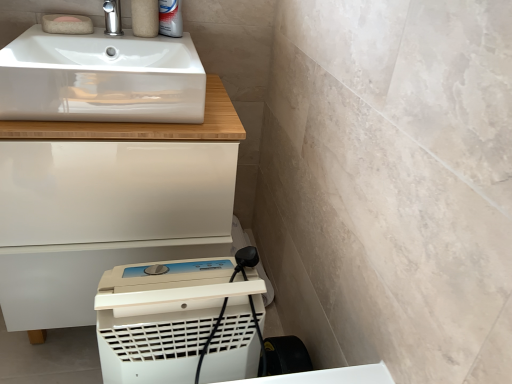
Measure the distance between point (174, 100) and camera.

Point (174, 100) is 37.24 inches from camera.

Describe the element at coordinates (68, 19) in the screenshot. The image size is (512, 384). I see `matte beige soap at upper left, the 2th soap positioned from the front` at that location.

Image resolution: width=512 pixels, height=384 pixels. What do you see at coordinates (177, 322) in the screenshot?
I see `white plastic dehumidifier at lower center` at bounding box center [177, 322].

Locate an element on the screen. pink felt soap at upper left, placed as the first soap when sorted from front to back is located at coordinates (67, 24).

Is point (73, 16) closer to camera compared to point (242, 366)?

No, (73, 16) is behind (242, 366).

What's the angular difference between pink felt soap at upper left, which is the 2th soap in back-to-front order, and white plastic dehumidifier at lower center's facing directions?

The angular difference between pink felt soap at upper left, which is the 2th soap in back-to-front order, and white plastic dehumidifier at lower center is 0.843 degrees.

Which object is further away from the camera, pink felt soap at upper left, which is the 2th soap in back-to-front order, or white plastic dehumidifier at lower center?

pink felt soap at upper left, which is the 2th soap in back-to-front order, is further away from the camera.

Is pink felt soap at upper left, which is the 2th soap in back-to-front order, turned away from white plastic dehumidifier at lower center?

pink felt soap at upper left, which is the 2th soap in back-to-front order, is not turned away from white plastic dehumidifier at lower center.

Identify the location of the 1st soap behind the polished chrome tap at upper left, counting from the anchor's position. The height and width of the screenshot is (384, 512). click(x=67, y=24).

Is pink felt soap at upper left, which is the 2th soap in back-to-front order, situated inside polished chrome tap at upper left or outside?

pink felt soap at upper left, which is the 2th soap in back-to-front order, is not enclosed by polished chrome tap at upper left.

Is the depth of pink felt soap at upper left, placed as the first soap when sorted from front to back, greater than that of polished chrome tap at upper left?

Yes, it is behind polished chrome tap at upper left.

From a real-world perspective, who is located lower, white glossy sink at upper left or pink felt soap at upper left, which is the 2th soap in back-to-front order?

white glossy sink at upper left is physically lower.

Is white glossy sink at upper left facing towards pink felt soap at upper left, placed as the first soap when sorted from front to back?

No, white glossy sink at upper left is not turned towards pink felt soap at upper left, placed as the first soap when sorted from front to back.

Is white glossy sink at upper left completely or partially outside of pink felt soap at upper left, which is the 2th soap in back-to-front order?

white glossy sink at upper left is positioned outside pink felt soap at upper left, which is the 2th soap in back-to-front order.

How many degrees apart are the facing directions of white glossy sink at upper left and pink felt soap at upper left, which is the 2th soap in back-to-front order?

Result: There is a 0.843-degree angle between the facing directions of white glossy sink at upper left and pink felt soap at upper left, which is the 2th soap in back-to-front order.

Can you tell me how much white plastic dehumidifier at lower center and white glossy sink at upper left differ in facing direction?

The angular difference between white plastic dehumidifier at lower center and white glossy sink at upper left is 0.000119 degrees.

Where is `sink located behind the white plastic dehumidifier at lower center`? This screenshot has width=512, height=384. sink located behind the white plastic dehumidifier at lower center is located at coordinates (101, 78).

Are white plastic dehumidifier at lower center and white glossy sink at upper left making contact?

No, white plastic dehumidifier at lower center is not in contact with white glossy sink at upper left.

From the image's perspective, does polished chrome tap at upper left appear lower than pink felt soap at upper left, which is the 2th soap in back-to-front order?

Incorrect, from the image's perspective, polished chrome tap at upper left is higher than pink felt soap at upper left, which is the 2th soap in back-to-front order.

Is polished chrome tap at upper left touching pink felt soap at upper left, placed as the first soap when sorted from front to back?

Absolutely, polished chrome tap at upper left is next to and touching pink felt soap at upper left, placed as the first soap when sorted from front to back.

From a real-world perspective, is polished chrome tap at upper left positioned above or below pink felt soap at upper left, placed as the first soap when sorted from front to back?

polished chrome tap at upper left is situated higher than pink felt soap at upper left, placed as the first soap when sorted from front to back, in the real world.

Is point (106, 10) farther from camera compared to point (61, 23)?

Yes, it is behind point (61, 23).

The image size is (512, 384). What are the coordinates of `appliance on the right of white glossy sink at upper left` in the screenshot? It's located at (177, 322).

Considering the sizes of white glossy sink at upper left and white plastic dehumidifier at lower center in the image, is white glossy sink at upper left wider or thinner than white plastic dehumidifier at lower center?

In the image, white glossy sink at upper left appears to be wider than white plastic dehumidifier at lower center.

Between white glossy sink at upper left and white plastic dehumidifier at lower center, which one has smaller size?

Smaller between the two is white plastic dehumidifier at lower center.

Is white plastic dehumidifier at lower center at the back of white glossy sink at upper left?

No, white glossy sink at upper left's orientation is not away from white plastic dehumidifier at lower center.

From a real-world perspective, which object rests below the other?

white plastic dehumidifier at lower center.

Considering the relative sizes of white plastic dehumidifier at lower center and pink felt soap at upper left, placed as the first soap when sorted from front to back, in the image provided, is white plastic dehumidifier at lower center thinner than pink felt soap at upper left, placed as the first soap when sorted from front to back,?

Incorrect, the width of white plastic dehumidifier at lower center is not less than that of pink felt soap at upper left, placed as the first soap when sorted from front to back.

Which object is further away from the camera, white plastic dehumidifier at lower center or pink felt soap at upper left, which is the 2th soap in back-to-front order?

pink felt soap at upper left, which is the 2th soap in back-to-front order, is further from the camera.

Based on the photo, is white plastic dehumidifier at lower center aimed at pink felt soap at upper left, placed as the first soap when sorted from front to back?

No, white plastic dehumidifier at lower center does not turn towards pink felt soap at upper left, placed as the first soap when sorted from front to back.

Locate an element on the screen. the 1st soap above the white plastic dehumidifier at lower center (from the image's perspective) is located at coordinates (67, 24).

What are the coordinates of `the 1st soap to the left of the polished chrome tap at upper left, counting from the anchor's position` in the screenshot? It's located at (67, 24).

Looking at this image, looking at the image, which one is located closer to pink felt soap at upper left, placed as the first soap when sorted from front to back, white glossy sink at upper left or white glossy cabinet at lower left?

Among the two, white glossy sink at upper left is located nearer to pink felt soap at upper left, placed as the first soap when sorted from front to back.

Considering their positions, is white glossy cabinet at lower left positioned closer to polished chrome tap at upper left than white plastic dehumidifier at lower center?

white glossy cabinet at lower left lies closer to polished chrome tap at upper left than the other object.

When comparing their distances from white glossy cabinet at lower left, does matte beige soap at upper left, arranged as the 1th soap when viewed from the back, or white glossy sink at upper left seem further?

matte beige soap at upper left, arranged as the 1th soap when viewed from the back, lies further to white glossy cabinet at lower left than the other object.

Based on their spatial positions, is white plastic dehumidifier at lower center or white glossy cabinet at lower left further from matte beige soap at upper left, the 2th soap positioned from the front?

The object further to matte beige soap at upper left, the 2th soap positioned from the front, is white plastic dehumidifier at lower center.

Which object lies further to the anchor point white plastic dehumidifier at lower center, white glossy sink at upper left or polished chrome tap at upper left?

Based on the image, polished chrome tap at upper left appears to be further to white plastic dehumidifier at lower center.

Considering their positions, is polished chrome tap at upper left positioned further to white glossy sink at upper left than matte beige soap at upper left, the 2th soap positioned from the front?

Based on the image, matte beige soap at upper left, the 2th soap positioned from the front, appears to be further to white glossy sink at upper left.

Looking at the image, which one is located closer to white plastic dehumidifier at lower center, white glossy cabinet at lower left or pink felt soap at upper left, placed as the first soap when sorted from front to back?

white glossy cabinet at lower left.

Consider the image. When comparing their distances from matte beige soap at upper left, the 2th soap positioned from the front, does pink felt soap at upper left, which is the 2th soap in back-to-front order, or polished chrome tap at upper left seem closer?

pink felt soap at upper left, which is the 2th soap in back-to-front order, is closer to matte beige soap at upper left, the 2th soap positioned from the front.

The height and width of the screenshot is (384, 512). Find the location of `sink between polished chrome tap at upper left and white glossy cabinet at lower left vertically`. sink between polished chrome tap at upper left and white glossy cabinet at lower left vertically is located at coordinates (101, 78).

At what (x,y) coordinates should I click in order to perform the action: click on sink that lies between pink felt soap at upper left, which is the 2th soap in back-to-front order, and white plastic dehumidifier at lower center from top to bottom. Please return your answer as a coordinate pair (x, y). This screenshot has height=384, width=512. Looking at the image, I should click on (101, 78).

Locate an element on the screen. The height and width of the screenshot is (384, 512). soap between matte beige soap at upper left, arranged as the 1th soap when viewed from the back, and white plastic dehumidifier at lower center in the up-down direction is located at coordinates (67, 24).

At what (x,y) coordinates should I click in order to perform the action: click on sink between polished chrome tap at upper left and white plastic dehumidifier at lower center from top to bottom. Please return your answer as a coordinate pair (x, y). Image resolution: width=512 pixels, height=384 pixels. Looking at the image, I should click on (101, 78).